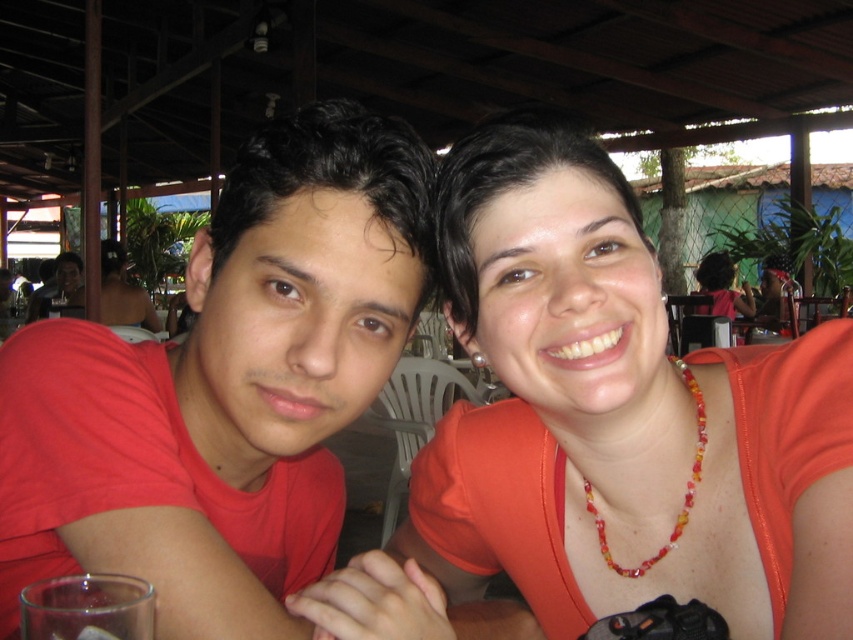
You are a photographer trying to capture a closeup of the multicolored beaded necklace at upper right and the matte orange shirt at upper right. From the perspective of the photographer standing directly in front of them, which object is positioned to the left?

The multicolored beaded necklace at upper right is to the left of the matte orange shirt at upper right, so from the photographer standing directly in front, the multicolored beaded necklace at upper right is positioned to the left.

You are a photographer setting up a shot of the two people. You need to ensure that the multicolored beaded necklace at upper right and the matte black laptop at left are both in frame. Which object should you position closer to the left side of your camera frame?

The matte black laptop at left should be positioned closer to the left side of the camera frame because the multicolored beaded necklace at upper right is located to the right of it.

You are a photographer standing at the edge of the outdoor dining area. You need to take a photo that includes both the matte orange shirt at upper right and the matte black laptop at left. Given their distance apart, will you be able to frame both subjects in a single shot without zooming in? Please explain your reasoning.

The matte orange shirt at upper right and the matte black laptop at left are 4.53 meters apart. Depending on the camera lens used, a wide angle lens could capture both subjects in a single frame without zooming in. However, if using a standard lens, you might need to step back or adjust your position to ensure both are in view.